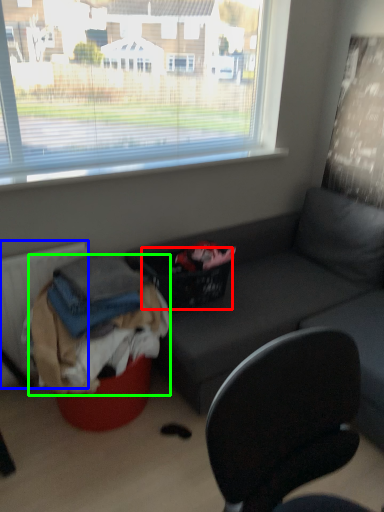
Question: Estimate the real-world distances between objects in this image. Which object is farther from basket (highlighted by a red box), radiator (highlighted by a blue box) or clothing (highlighted by a green box)?

Choices:
 (A) radiator
 (B) clothing

Answer: (A)